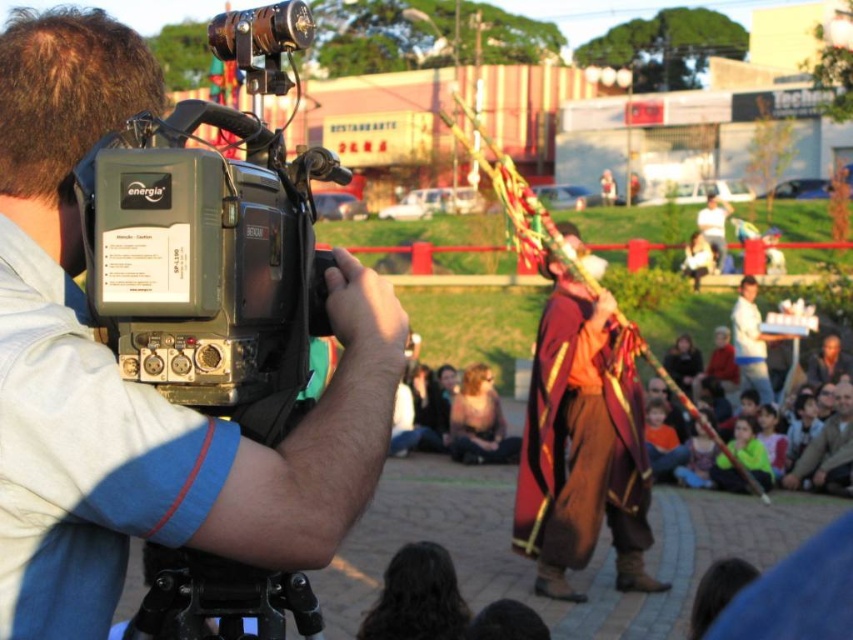
Between matte black camera at upper left and velvet maroon cape at center, which one has more height?

Standing taller between the two is velvet maroon cape at center.

Who is positioned more to the left, matte black camera at upper left or velvet maroon cape at center?

matte black camera at upper left

Does point (294, 467) lie in front of point (552, 564)?

Yes.

This screenshot has width=853, height=640. What are the coordinates of `matte black camera at upper left` in the screenshot? It's located at (141, 384).

Is matte black camera at upper left shorter than black plastic camera at left?

Incorrect, matte black camera at upper left's height does not fall short of black plastic camera at left's.

Between point (368, 356) and point (144, 317), which one is positioned behind?

Positioned behind is point (368, 356).

Is point (357, 280) positioned before point (146, 321)?

No, (357, 280) is behind (146, 321).

Locate an element on the screen. This screenshot has height=640, width=853. matte black camera at upper left is located at coordinates (141, 384).

Is point (260, 337) more distant than point (624, 536)?

No, it is not.

Find the location of a particular element. The height and width of the screenshot is (640, 853). black plastic camera at left is located at coordinates (206, 257).